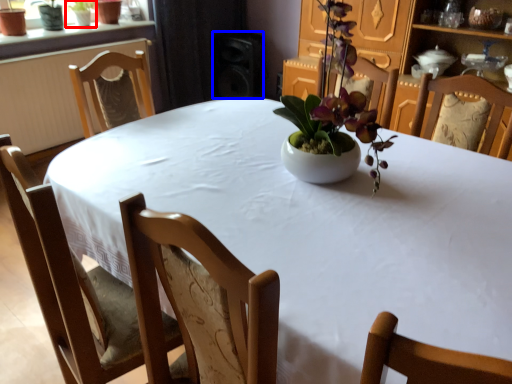
Question: Which point is further to the camera, houseplant (highlighted by a red box) or speaker (highlighted by a blue box)?

Choices:
 (A) houseplant
 (B) speaker

Answer: (B)